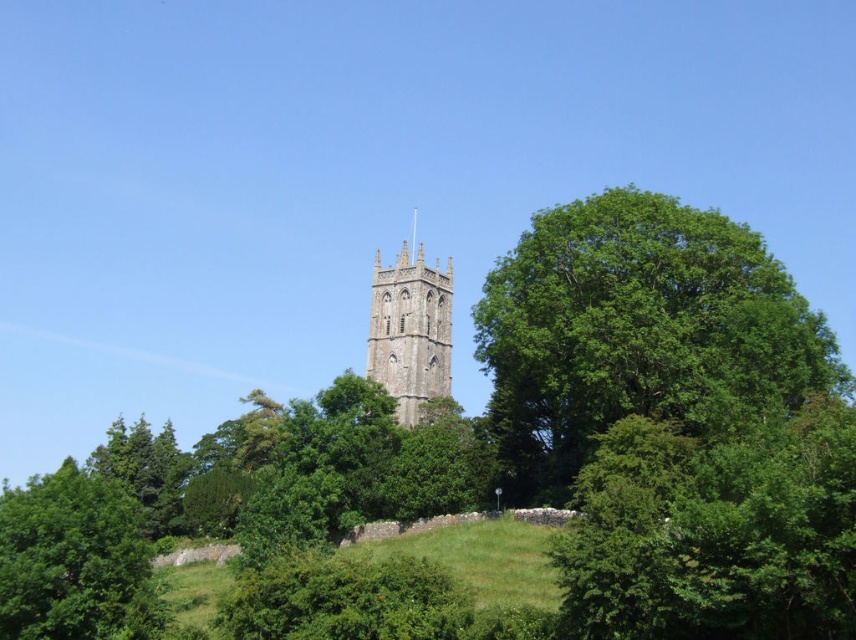
Who is shorter, green leafy tree at right or green leafy tree at lower left?

With less height is green leafy tree at lower left.

Between point (685, 358) and point (94, 563), which one is positioned in front?

Positioned in front is point (94, 563).

The image size is (856, 640). I want to click on green leafy tree at right, so click(637, 332).

Does green leafy tree at right have a lesser width compared to stone tower at center?

Incorrect, green leafy tree at right's width is not less than stone tower at center's.

Find the location of `green leafy tree at right`. green leafy tree at right is located at coordinates (637, 332).

Does green leafy tree at lower left have a greater height compared to stone tower at center?

No, green leafy tree at lower left is not taller than stone tower at center.

Which is more to the left, green leafy tree at lower left or stone tower at center?

green leafy tree at lower left

Find the location of a particular element. green leafy tree at lower left is located at coordinates (74, 561).

You are a GUI agent. You are given a task and a screenshot of the screen. Output one action in this format:
    pyautogui.click(x=<x>, y=<y>)
    Task: Click on the green leafy tree at lower left
    The image size is (856, 640).
    Given the screenshot: What is the action you would take?
    pos(74,561)